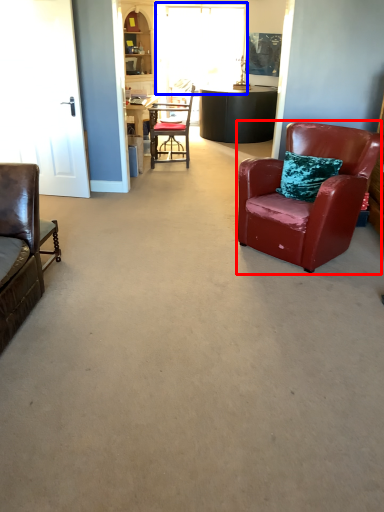
Question: Which of the following is the farthest to the observer, chair (highlighted by a red box) or window (highlighted by a blue box)?

Choices:
 (A) chair
 (B) window

Answer: (B)